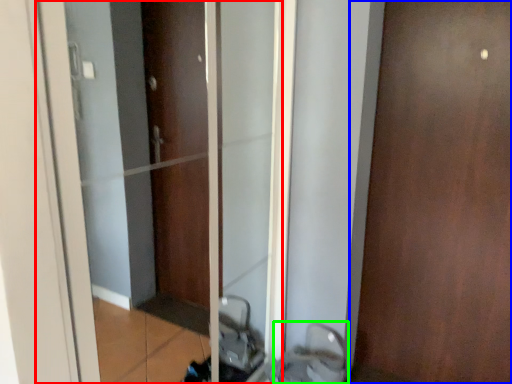
Question: Estimate the real-world distances between objects in this image. Which object is farther from elevator (highlighted by a red box), door (highlighted by a blue box) or sink (highlighted by a green box)?

Choices:
 (A) door
 (B) sink

Answer: (A)